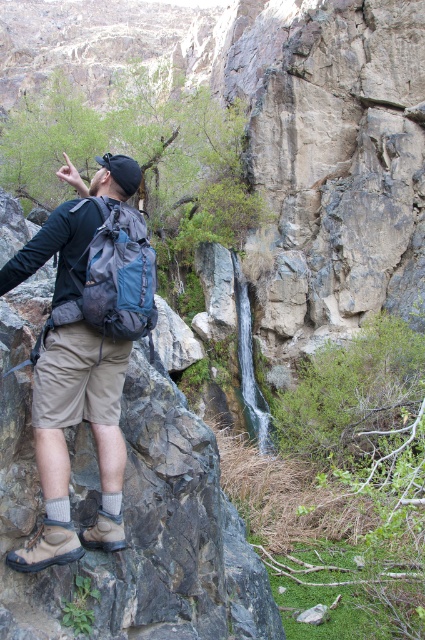
You are a hiker trying to navigate through the rocky terrain. You notice two matte blue backpacks in your view. Which one is closer to you, the matte blue backpack at center or the matte blue backpack at left?

The matte blue backpack at center is closer to you because it is in front of the matte blue backpack at left.